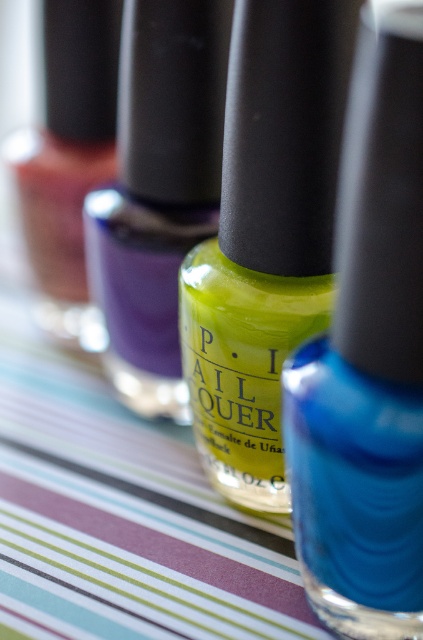
Consider the image. Please provide the coordinates of the matte yellow nail polish at center in the image. The coordinates should be in the format of a point with two decimal places, like this example format point 0.564, 0.870. Please do not add any extra text or explanation, just the coordinates in the specified format.

The coordinates of the matte yellow nail polish at center are point (x=368, y=360).

You are looking at the arrangement of nail polish bottles on the striped surface. There are two points marked in the image. The first point is at coordinate point (411, 420) and the second is at point (112, 257). Which of these two points is nearer to you?

Point (411, 420) is closer to the viewer than point (112, 257).

You are holding a smartphone with a 6.5 inch screen. You want to take a photo of the matte yellow nail polish at center to show its label details. If the smartphone is 17.30 inches away from the nail polish, will the entire label fit within the screen?

The matte yellow nail polish at center and camera are 17.30 inches apart. Since the smartphone screen is 6.5 inches wide, the label details may not fit entirely within the screen unless zoomed out or moved further back.